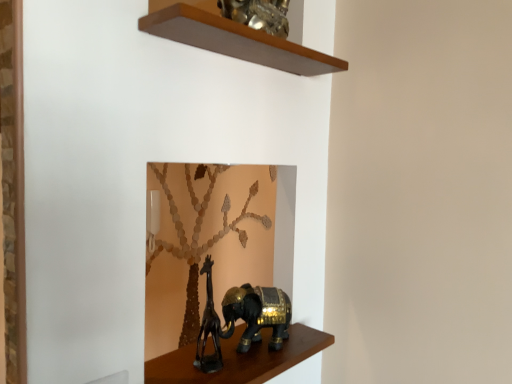
Question: Is wooden shelf at upper center, placed as the 1th shelf when sorted from top to bottom, outside shiny black elephant at lower center, which is the 1th shelf in bottom-to-top order?

Choices:
 (A) no
 (B) yes

Answer: (B)

Question: Is wooden shelf at upper center, which is counted as the 2th shelf, starting from the bottom, at the right side of shiny black elephant at lower center, which is the 1th shelf in bottom-to-top order?

Choices:
 (A) yes
 (B) no

Answer: (A)

Question: Is wooden shelf at upper center, which is counted as the 2th shelf, starting from the bottom, next to shiny black elephant at lower center, which is the 1th shelf in bottom-to-top order, and touching it?

Choices:
 (A) no
 (B) yes

Answer: (A)

Question: Considering the relative positions of wooden shelf at upper center, placed as the 1th shelf when sorted from top to bottom, and shiny black elephant at lower center, which is the 1th shelf in bottom-to-top order, in the image provided, is wooden shelf at upper center, placed as the 1th shelf when sorted from top to bottom, to the left of shiny black elephant at lower center, which is the 1th shelf in bottom-to-top order, from the viewer's perspective?

Choices:
 (A) no
 (B) yes

Answer: (A)

Question: Is shiny black elephant at lower center, the 2th shelf when ordered from top to bottom, surrounded by wooden shelf at upper center, placed as the 1th shelf when sorted from top to bottom?

Choices:
 (A) no
 (B) yes

Answer: (A)

Question: Is shiny black elephant at lower center, the 2th shelf when ordered from top to bottom, inside or outside of gold metallic elephant at center?

Choices:
 (A) inside
 (B) outside

Answer: (B)

Question: From a real-world perspective, is shiny black elephant at lower center, the 2th shelf when ordered from top to bottom, positioned above or below gold metallic elephant at center?

Choices:
 (A) below
 (B) above

Answer: (A)

Question: Does point tap(252, 354) appear closer or farther from the camera than point tap(246, 292)?

Choices:
 (A) farther
 (B) closer

Answer: (B)

Question: From their relative heights in the image, would you say shiny black elephant at lower center, which is the 1th shelf in bottom-to-top order, is taller or shorter than gold metallic elephant at center?

Choices:
 (A) short
 (B) tall

Answer: (A)

Question: Which is correct: shiny black elephant at lower center, which is the 1th shelf in bottom-to-top order, is inside wooden shelf at upper center, placed as the 1th shelf when sorted from top to bottom, or outside of it?

Choices:
 (A) inside
 (B) outside

Answer: (B)

Question: Is point (300, 342) closer or farther from the camera than point (273, 59)?

Choices:
 (A) farther
 (B) closer

Answer: (A)

Question: Visually, is shiny black elephant at lower center, the 2th shelf when ordered from top to bottom, positioned to the left or to the right of wooden shelf at upper center, which is counted as the 2th shelf, starting from the bottom?

Choices:
 (A) left
 (B) right

Answer: (A)

Question: Looking at their shapes, would you say shiny black elephant at lower center, which is the 1th shelf in bottom-to-top order, is wider or thinner than wooden shelf at upper center, placed as the 1th shelf when sorted from top to bottom?

Choices:
 (A) wide
 (B) thin

Answer: (B)

Question: In terms of height, does wooden shelf at upper center, which is counted as the 2th shelf, starting from the bottom, look taller or shorter compared to shiny black elephant at lower center, the 2th shelf when ordered from top to bottom?

Choices:
 (A) short
 (B) tall

Answer: (B)

Question: In the image, is wooden shelf at upper center, which is counted as the 2th shelf, starting from the bottom, positioned in front of or behind shiny black elephant at lower center, the 2th shelf when ordered from top to bottom?

Choices:
 (A) front
 (B) behind

Answer: (A)